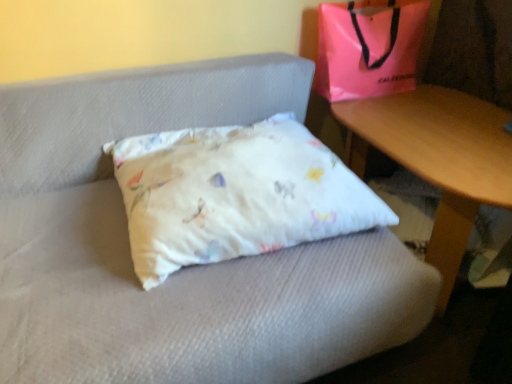
Question: From the image's perspective, would you say wooden table at lower right is shown under pink plastic bag at upper right?

Choices:
 (A) yes
 (B) no

Answer: (A)

Question: Is wooden table at lower right taller than pink plastic bag at upper right?

Choices:
 (A) no
 (B) yes

Answer: (B)

Question: From the image's perspective, is wooden table at lower right located above pink plastic bag at upper right?

Choices:
 (A) yes
 (B) no

Answer: (B)

Question: Does wooden table at lower right appear on the right side of pink plastic bag at upper right?

Choices:
 (A) yes
 (B) no

Answer: (A)

Question: Is wooden table at lower right bigger than pink plastic bag at upper right?

Choices:
 (A) yes
 (B) no

Answer: (A)

Question: Could you tell me if wooden table at lower right is turned towards pink plastic bag at upper right?

Choices:
 (A) no
 (B) yes

Answer: (A)

Question: Is white cotton pillow at center thinner than wooden table at lower right?

Choices:
 (A) yes
 (B) no

Answer: (B)

Question: From a real-world perspective, is white cotton pillow at center beneath wooden table at lower right?

Choices:
 (A) yes
 (B) no

Answer: (B)

Question: Does white cotton pillow at center come in front of wooden table at lower right?

Choices:
 (A) yes
 (B) no

Answer: (A)

Question: Is white cotton pillow at center next to wooden table at lower right?

Choices:
 (A) yes
 (B) no

Answer: (B)

Question: From a real-world perspective, does white cotton pillow at center stand above wooden table at lower right?

Choices:
 (A) no
 (B) yes

Answer: (B)

Question: From the image's perspective, is white cotton pillow at center under wooden table at lower right?

Choices:
 (A) yes
 (B) no

Answer: (B)

Question: From the image's perspective, does wooden table at lower right appear lower than white cotton pillow at center?

Choices:
 (A) yes
 (B) no

Answer: (A)